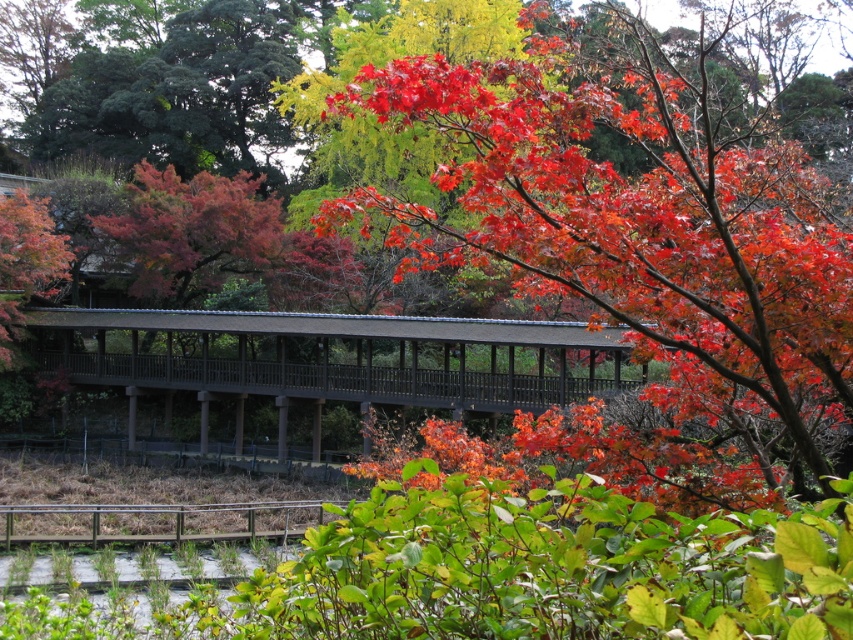
You are standing on the covered bridge and want to determine which of the two points, point [810,419] or point [556,388], is nearer to you. Can you identify the closer one based on their positions?

Point [810,419] is closer to the viewer than point [556,388].

You are standing on the brown wooden bridge at center and want to pick up a shiny red maple leaf. In which direction should you walk to reach the shiny red maple at center?

The shiny red maple at center is to the right of the brown wooden bridge at center, so you should walk to the right to reach it.